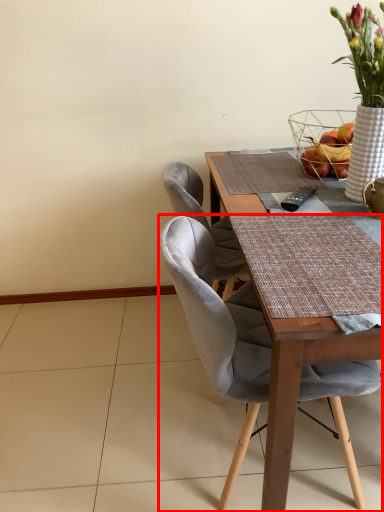
Question: From the image's perspective, considering the relative positions of chair (annotated by the red box) and basket in the image provided, where is chair (annotated by the red box) located with respect to the staircase?

Choices:
 (A) below
 (B) above

Answer: (A)